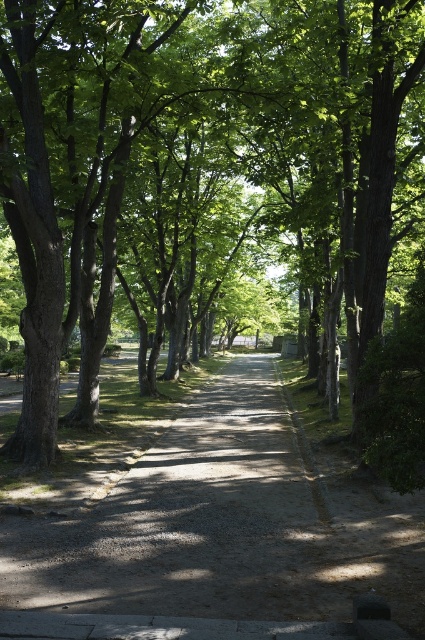
You are standing at the start of the pathway in the image. There is a point marked at coordinates (217, 161). What object is located at that point?

The point at coordinates (217, 161) corresponds to the green leafy tree at center.